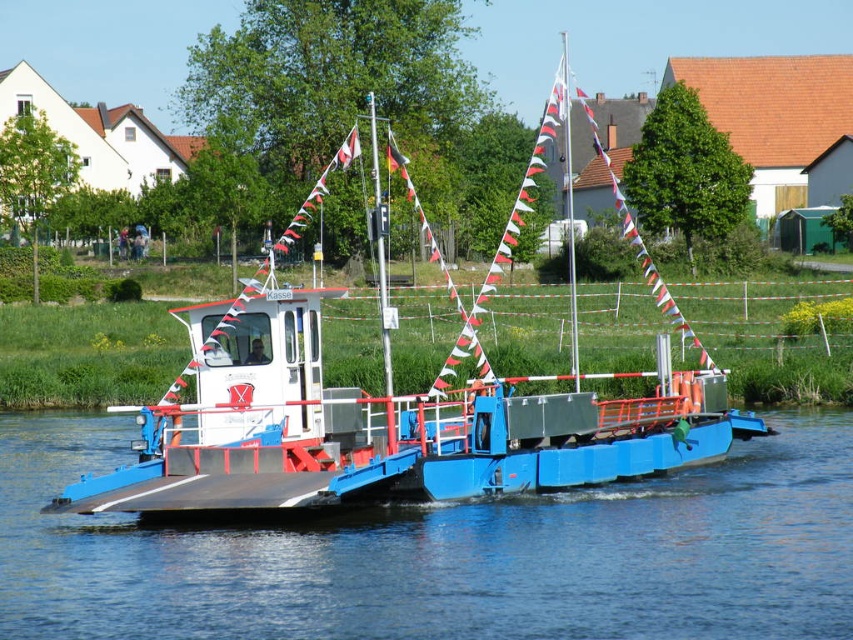
You are a passenger on the ferry and want to take a photo of the blue metallic river at center from the blue matte ferryboat at center. Which side of the ferry should you stand on to capture the river in your shot?

To photograph the blue metallic river at center from the blue matte ferryboat at center, you should stand on the right side of the ferry since the blue metallic river at center is positioned on the right side of the blue matte ferryboat at center.

What is located at the coordinates point (445, 554) on the ferry boat?

The blue metallic river at center is located at point (445, 554).